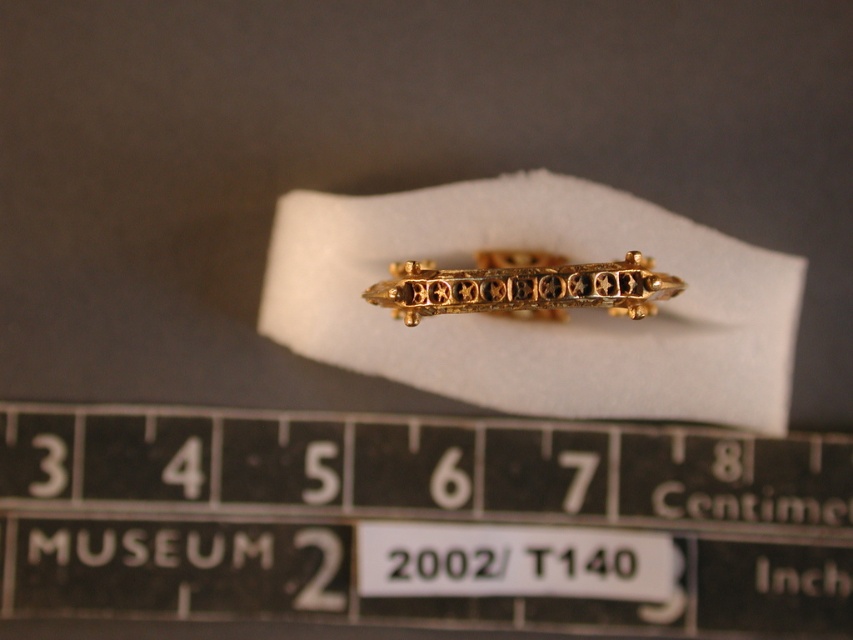
Question: Which of the following is the farthest from the observer?

Choices:
 (A) (41, 460)
 (B) (505, 269)

Answer: (A)

Question: Is metallic black ruler at center bigger than goldmaterial/texture ring at center?

Choices:
 (A) yes
 (B) no

Answer: (A)

Question: Does metallic black ruler at center have a smaller size compared to goldmaterial/texture ring at center?

Choices:
 (A) no
 (B) yes

Answer: (A)

Question: Among these points, which one is nearest to the camera?

Choices:
 (A) (577, 296)
 (B) (325, 522)

Answer: (A)

Question: Can you confirm if metallic black ruler at center is bigger than goldmaterial/texture ring at center?

Choices:
 (A) no
 (B) yes

Answer: (B)

Question: Among these objects, which one is nearest to the camera?

Choices:
 (A) metallic black ruler at center
 (B) goldmaterial/texture ring at center

Answer: (B)